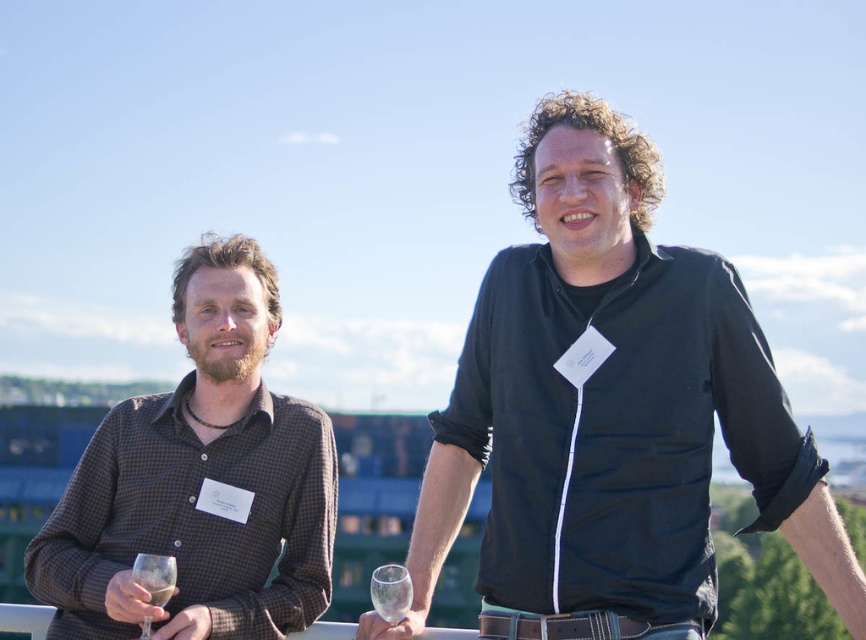
Question: Does brown leather belt at center have a smaller size compared to translucent glass wine at lower left?

Choices:
 (A) no
 (B) yes

Answer: (B)

Question: Among these objects, which one is nearest to the camera?

Choices:
 (A) brown checkered shirt at left
 (B) brown leather belt at center
 (C) transparent glass at lower left
 (D) black matte shirt at center

Answer: (D)

Question: Among these objects, which one is nearest to the camera?

Choices:
 (A) clear glass wine glass at center
 (B) brown checkered shirt at left
 (C) transparent glass at lower left
 (D) translucent glass wine at lower left

Answer: (B)

Question: Based on their relative distances, which object is nearer to the translucent glass wine at lower left?

Choices:
 (A) clear glass wine glass at center
 (B) brown checkered shirt at left
 (C) brown leather belt at center

Answer: (B)

Question: Is brown leather belt at center further to camera compared to translucent glass wine at lower left?

Choices:
 (A) yes
 (B) no

Answer: (A)

Question: Is black matte shirt at center behind transparent glass at lower left?

Choices:
 (A) yes
 (B) no

Answer: (B)